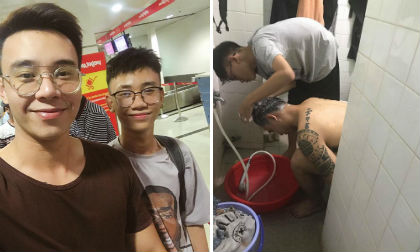
Find the location of `ceiling lights`. ceiling lights is located at coordinates (117, 5), (170, 16).